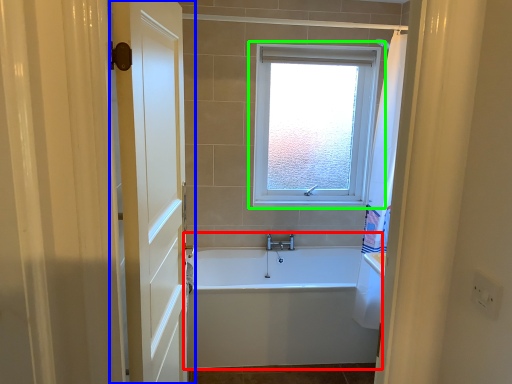
Question: Which object is positioned farthest from bathtub (highlighted by a red box)? Select from door (highlighted by a blue box) and window (highlighted by a green box).

Choices:
 (A) door
 (B) window

Answer: (B)